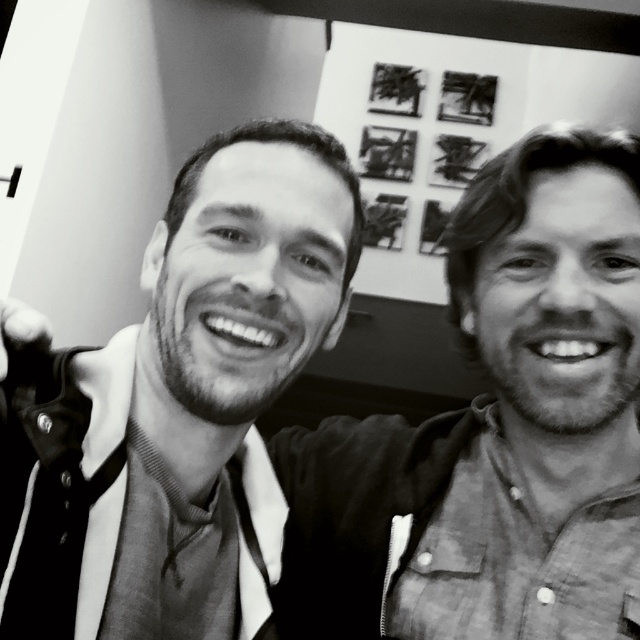
Question: Does smooth black shirt at center come behind smooth black shirt at left?

Choices:
 (A) no
 (B) yes

Answer: (B)

Question: Which is farther from the smooth black shirt at center?

Choices:
 (A) matte black tie at center
 (B) smooth black shirt at left

Answer: (A)

Question: Considering the relative positions of smooth black shirt at left and matte black tie at center in the image provided, where is smooth black shirt at left located with respect to matte black tie at center?

Choices:
 (A) right
 (B) left

Answer: (A)

Question: Considering the real-world distances, which object is closest to the matte black tie at center?

Choices:
 (A) smooth black shirt at center
 (B) smooth black shirt at left

Answer: (B)

Question: Which point is farther to the camera?

Choices:
 (A) smooth black shirt at left
 (B) matte black tie at center
 (C) smooth black shirt at center

Answer: (C)

Question: Does smooth black shirt at left lie behind matte black tie at center?

Choices:
 (A) no
 (B) yes

Answer: (A)